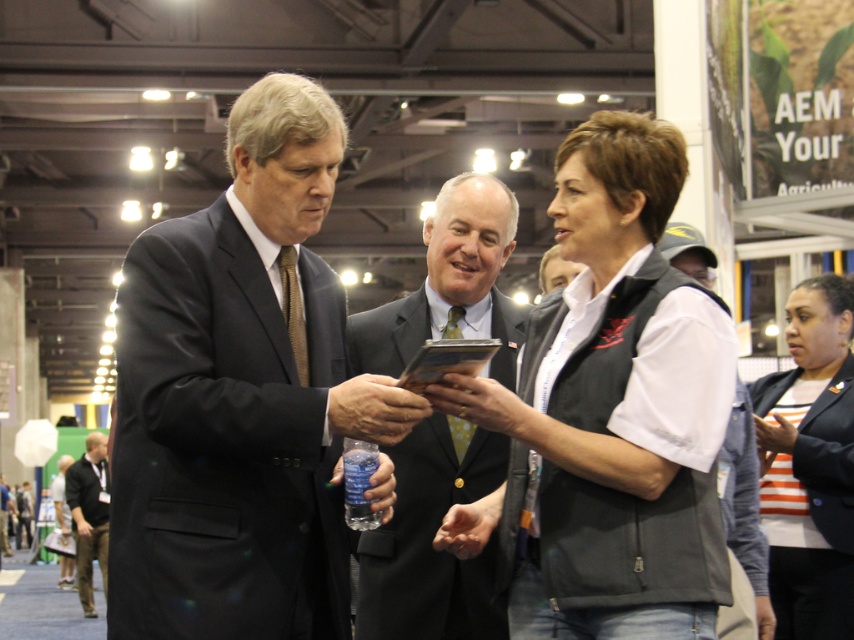
Can you confirm if denim jacket at right is wider than black cotton shirt at lower left?

No, denim jacket at right is not wider than black cotton shirt at lower left.

Does point (733, 484) come behind point (89, 600)?

No, (733, 484) is in front of (89, 600).

The image size is (854, 640). Find the location of `denim jacket at right`. denim jacket at right is located at coordinates (743, 525).

Who is positioned more to the right, black cotton shirt at lower left or dark gray suit at center?

black cotton shirt at lower left

Is black cotton shirt at lower left smaller than dark gray suit at center?

No.

Where is `black cotton shirt at lower left`? The width and height of the screenshot is (854, 640). black cotton shirt at lower left is located at coordinates (89, 515).

Which is above, matte black suit at center or matte black vest at center?

matte black suit at center is higher up.

Can you confirm if matte black suit at center is positioned to the right of matte black vest at center?

Incorrect, matte black suit at center is not on the right side of matte black vest at center.

Between point (270, 406) and point (560, 333), which one is positioned behind?

The point (560, 333) is behind.

The height and width of the screenshot is (640, 854). What are the coordinates of `matte black suit at center` in the screenshot? It's located at (240, 396).